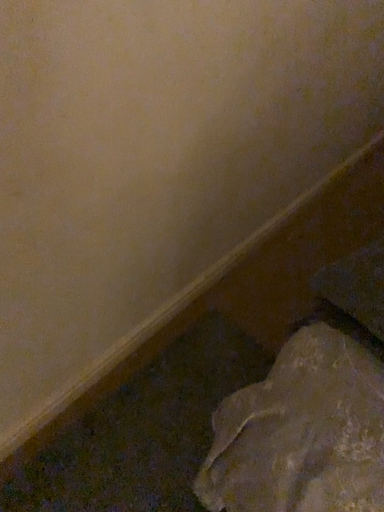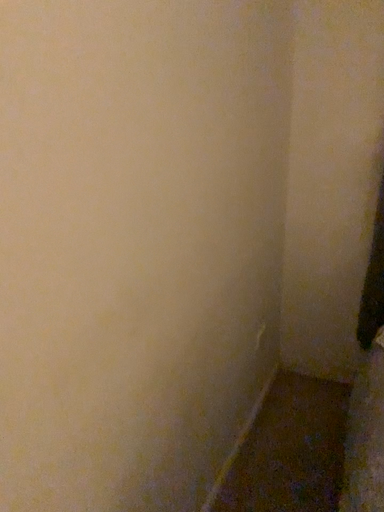
Question: How did the camera likely rotate when shooting the video?

Choices:
 (A) rotated downward
 (B) rotated upward

Answer: (B)